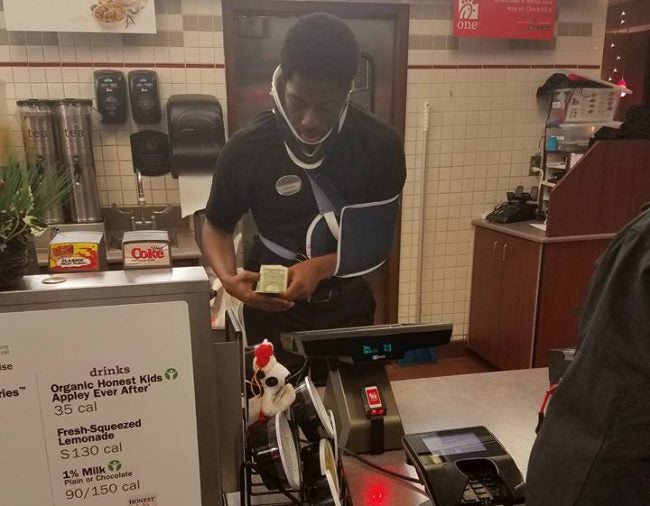
Identify the location of tea dispenser. The height and width of the screenshot is (506, 650). (36, 153), (73, 155).